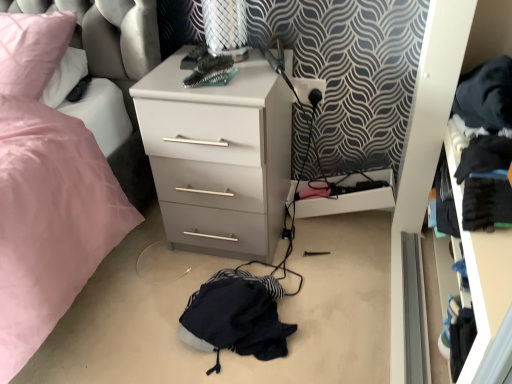
Question: Is black plastic electric outlet at upper right at the right side of white plastic drawer at lower center?

Choices:
 (A) yes
 (B) no

Answer: (B)

Question: From the image's perspective, is black plastic electric outlet at upper right above white plastic drawer at lower center?

Choices:
 (A) no
 (B) yes

Answer: (B)

Question: From a real-world perspective, is black plastic electric outlet at upper right physically above white plastic drawer at lower center?

Choices:
 (A) no
 (B) yes

Answer: (B)

Question: Does black plastic electric outlet at upper right have a smaller size compared to white plastic drawer at lower center?

Choices:
 (A) yes
 (B) no

Answer: (A)

Question: Is black plastic electric outlet at upper right positioned before white plastic drawer at lower center?

Choices:
 (A) yes
 (B) no

Answer: (B)

Question: Is black plastic electric outlet at upper right in contact with white plastic drawer at lower center?

Choices:
 (A) no
 (B) yes

Answer: (A)

Question: From a real-world perspective, is pink fabric swivel chair at upper left beneath black fabric drawer at right?

Choices:
 (A) no
 (B) yes

Answer: (A)

Question: From the image's perspective, is pink fabric swivel chair at upper left beneath black fabric drawer at right?

Choices:
 (A) yes
 (B) no

Answer: (B)

Question: Is pink fabric swivel chair at upper left positioned far away from black fabric drawer at right?

Choices:
 (A) no
 (B) yes

Answer: (B)

Question: From a real-world perspective, does pink fabric swivel chair at upper left stand above black fabric drawer at right?

Choices:
 (A) yes
 (B) no

Answer: (A)

Question: From the image's perspective, would you say pink fabric swivel chair at upper left is positioned over black fabric drawer at right?

Choices:
 (A) yes
 (B) no

Answer: (A)

Question: Could black fabric drawer at right be considered to be inside pink fabric swivel chair at upper left?

Choices:
 (A) yes
 (B) no

Answer: (B)

Question: Does dark blue fabric at center appear on the left side of pink fabric swivel chair at upper left?

Choices:
 (A) no
 (B) yes

Answer: (A)